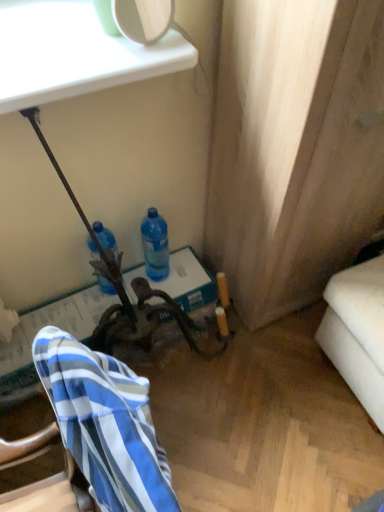
Question: From a real-world perspective, is blue translucent bottle at center, placed as the first bottle when sorted from right to left, physically below blue striped fabric at lower left?

Choices:
 (A) yes
 (B) no

Answer: (A)

Question: Considering the relative positions of blue translucent bottle at center, placed as the first bottle when sorted from right to left, and blue striped fabric at lower left in the image provided, is blue translucent bottle at center, placed as the first bottle when sorted from right to left, to the left of blue striped fabric at lower left from the viewer's perspective?

Choices:
 (A) yes
 (B) no

Answer: (B)

Question: Can you confirm if blue translucent bottle at center, placed as the first bottle when sorted from right to left, is wider than blue striped fabric at lower left?

Choices:
 (A) yes
 (B) no

Answer: (B)

Question: Considering the relative sizes of blue translucent bottle at center, which ranks as the 2th bottle in left-to-right order, and blue striped fabric at lower left in the image provided, is blue translucent bottle at center, which ranks as the 2th bottle in left-to-right order, taller than blue striped fabric at lower left?

Choices:
 (A) no
 (B) yes

Answer: (A)

Question: From a real-world perspective, is blue translucent bottle at center, which ranks as the 2th bottle in left-to-right order, physically above blue striped fabric at lower left?

Choices:
 (A) yes
 (B) no

Answer: (B)

Question: In terms of size, does blue translucent bottle at center, which is the second bottle from right to left, appear bigger or smaller than blue striped fabric at lower left?

Choices:
 (A) big
 (B) small

Answer: (B)

Question: From a real-world perspective, is blue translucent bottle at center, arranged as the 1th bottle when viewed from the left, positioned above or below blue striped fabric at lower left?

Choices:
 (A) above
 (B) below

Answer: (B)

Question: Is point (91, 240) closer or farther from the camera than point (102, 442)?

Choices:
 (A) closer
 (B) farther

Answer: (B)

Question: From the image's perspective, is blue translucent bottle at center, which is the second bottle from right to left, located above or below blue striped fabric at lower left?

Choices:
 (A) above
 (B) below

Answer: (A)

Question: Does point (112, 384) appear closer or farther from the camera than point (142, 225)?

Choices:
 (A) farther
 (B) closer

Answer: (B)

Question: From the image's perspective, is blue striped fabric at lower left above or below blue translucent bottle at center, which ranks as the 2th bottle in left-to-right order?

Choices:
 (A) above
 (B) below

Answer: (B)

Question: In the image, is blue striped fabric at lower left on the left side or the right side of blue translucent bottle at center, placed as the first bottle when sorted from right to left?

Choices:
 (A) right
 (B) left

Answer: (B)

Question: Is blue striped fabric at lower left inside or outside of blue translucent bottle at center, which ranks as the 2th bottle in left-to-right order?

Choices:
 (A) outside
 (B) inside

Answer: (A)

Question: Considering the positions of blue translucent bottle at center, placed as the first bottle when sorted from right to left, and blue striped fabric at lower left in the image, is blue translucent bottle at center, placed as the first bottle when sorted from right to left, wider or thinner than blue striped fabric at lower left?

Choices:
 (A) wide
 (B) thin

Answer: (B)

Question: Would you say blue translucent bottle at center, placed as the first bottle when sorted from right to left, is to the left or to the right of blue striped fabric at lower left in the picture?

Choices:
 (A) left
 (B) right

Answer: (B)